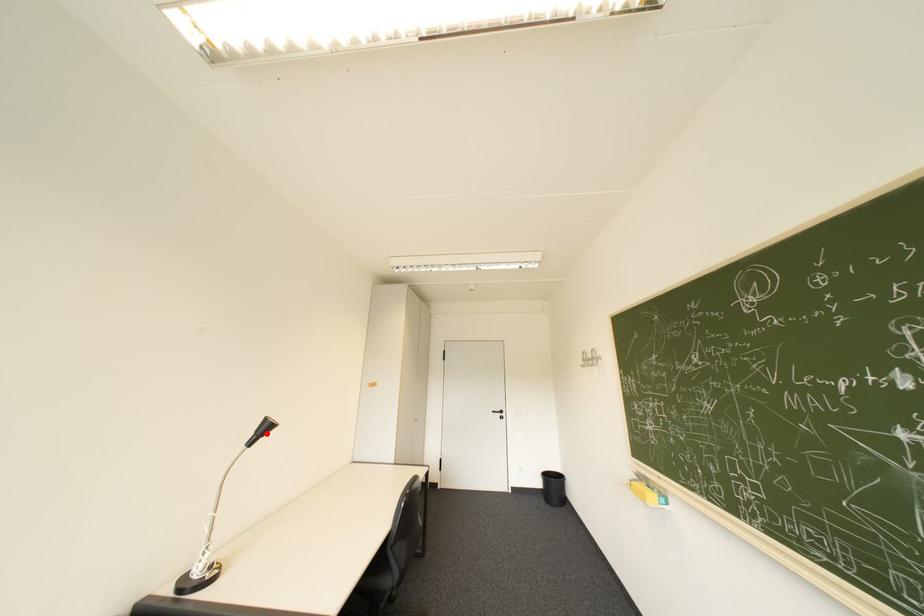
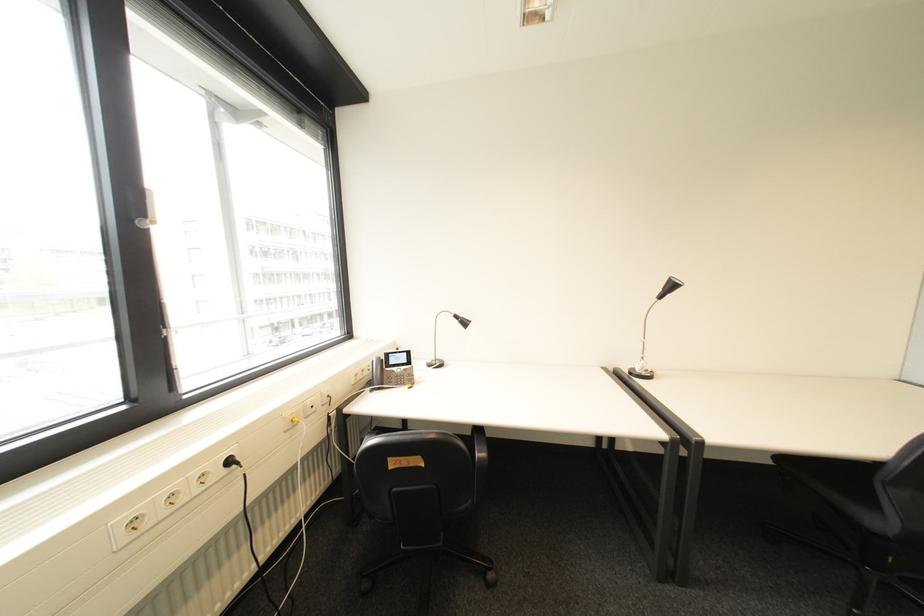
Where in the second image is the point corresponding to the highlighted location from the first image?

(673, 290)